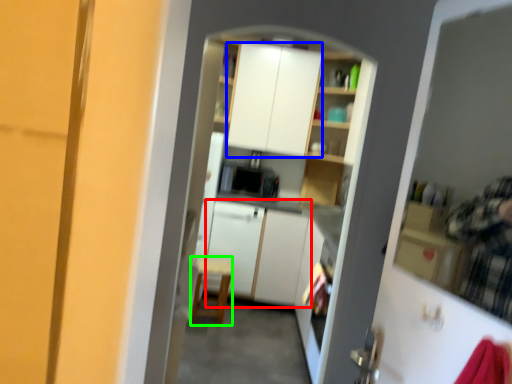
Question: Based on their relative distances, which object is nearer to cabinetry (highlighted by a red box)? Choose from cabinetry (highlighted by a blue box) and chair (highlighted by a green box).

Choices:
 (A) cabinetry
 (B) chair

Answer: (B)